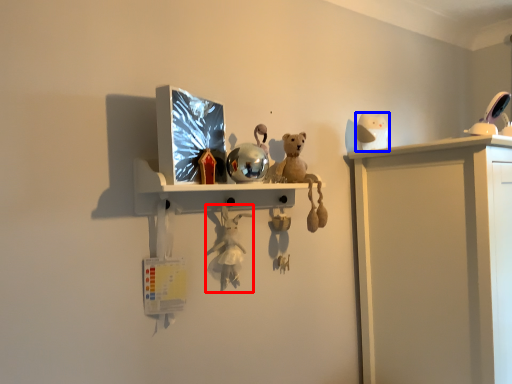
Question: Which object appears farthest to the camera in this image, toy (highlighted by a red box) or toy (highlighted by a blue box)?

Choices:
 (A) toy
 (B) toy

Answer: (B)